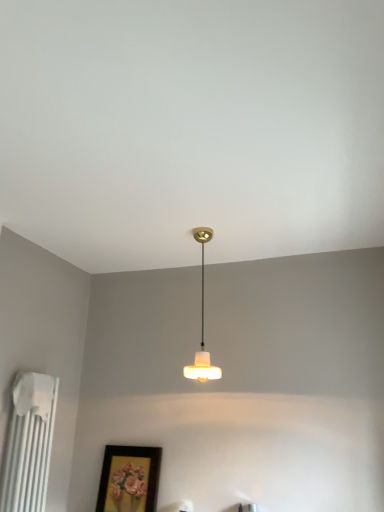
Question: Is white frosted glass lampshade at center further to the viewer compared to white matte radiator at left?

Choices:
 (A) yes
 (B) no

Answer: (A)

Question: Is white matte radiator at left completely or partially inside white frosted glass lampshade at center?

Choices:
 (A) yes
 (B) no

Answer: (B)

Question: Does white frosted glass lampshade at center have a lesser width compared to white matte radiator at left?

Choices:
 (A) no
 (B) yes

Answer: (A)

Question: Considering the relative sizes of white frosted glass lampshade at center and white matte radiator at left in the image provided, is white frosted glass lampshade at center shorter than white matte radiator at left?

Choices:
 (A) yes
 (B) no

Answer: (B)

Question: Considering the relative positions of white frosted glass lampshade at center and white matte radiator at left in the image provided, is white frosted glass lampshade at center to the right of white matte radiator at left from the viewer's perspective?

Choices:
 (A) yes
 (B) no

Answer: (A)

Question: Is white frosted glass lampshade at center oriented away from white matte radiator at left?

Choices:
 (A) no
 (B) yes

Answer: (A)

Question: Considering the relative sizes of matte gold picture frame at lower center and white frosted glass lampshade at center in the image provided, is matte gold picture frame at lower center taller than white frosted glass lampshade at center?

Choices:
 (A) no
 (B) yes

Answer: (A)

Question: Does matte gold picture frame at lower center have a lesser width compared to white frosted glass lampshade at center?

Choices:
 (A) yes
 (B) no

Answer: (A)

Question: Is matte gold picture frame at lower center to the right of white frosted glass lampshade at center from the viewer's perspective?

Choices:
 (A) yes
 (B) no

Answer: (B)

Question: From a real-world perspective, does matte gold picture frame at lower center stand above white frosted glass lampshade at center?

Choices:
 (A) no
 (B) yes

Answer: (A)

Question: Is matte gold picture frame at lower center outside white frosted glass lampshade at center?

Choices:
 (A) no
 (B) yes

Answer: (B)

Question: Considering the relative sizes of matte gold picture frame at lower center and white frosted glass lampshade at center in the image provided, is matte gold picture frame at lower center smaller than white frosted glass lampshade at center?

Choices:
 (A) no
 (B) yes

Answer: (B)

Question: Could you tell me if matte gold picture frame at lower center is turned towards white matte radiator at left?

Choices:
 (A) yes
 (B) no

Answer: (A)